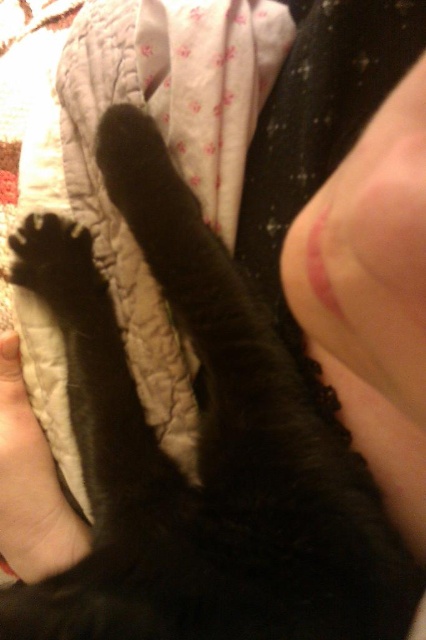
Question: Can you confirm if smooth skin at upper right is thinner than smooth skin hand at lower left?

Choices:
 (A) yes
 (B) no

Answer: (B)

Question: Can you confirm if smooth skin at upper right is positioned to the left of smooth skin hand at lower left?

Choices:
 (A) yes
 (B) no

Answer: (B)

Question: Which point appears farthest from the camera in this image?

Choices:
 (A) pos(313,275)
 (B) pos(42,500)

Answer: (B)

Question: Which point is closer to the camera taking this photo?

Choices:
 (A) (411, 138)
 (B) (16, 349)

Answer: (A)

Question: Does smooth skin at upper right have a lesser width compared to smooth skin hand at lower left?

Choices:
 (A) no
 (B) yes

Answer: (A)